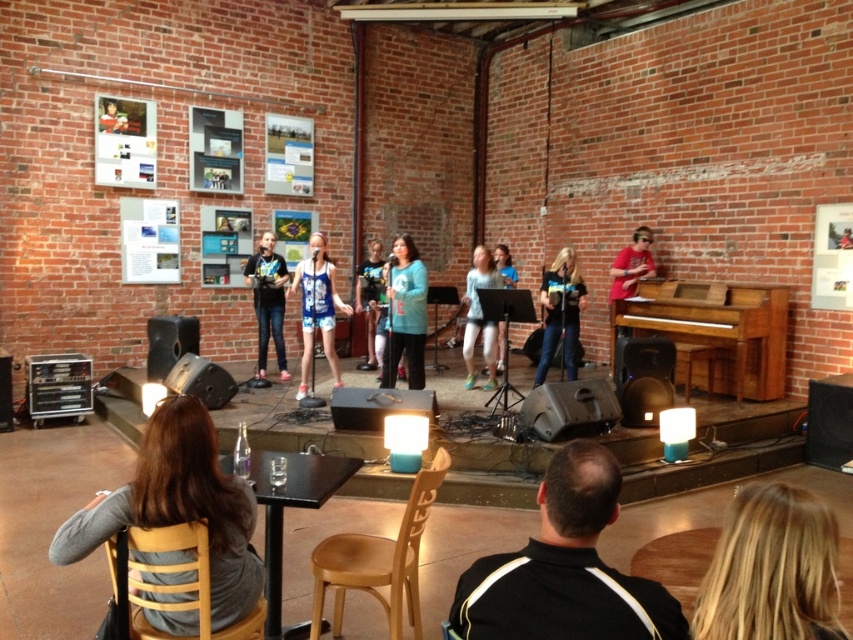
Can you confirm if matte blue jeans at center is positioned above blue denim shorts at center?

Incorrect, matte blue jeans at center is not positioned above blue denim shorts at center.

From the picture: Can you confirm if matte blue jeans at center is positioned below blue denim shorts at center?

Correct, matte blue jeans at center is located below blue denim shorts at center.

The width and height of the screenshot is (853, 640). Describe the element at coordinates (560, 312) in the screenshot. I see `matte blue jeans at center` at that location.

I want to click on matte blue jeans at center, so click(560, 312).

Which is below, matte black speaker at lower left or matte red shirt at right?

matte black speaker at lower left

Is matte black speaker at lower left thinner than matte red shirt at right?

In fact, matte black speaker at lower left might be wider than matte red shirt at right.

You are a GUI agent. You are given a task and a screenshot of the screen. Output one action in this format:
    pyautogui.click(x=<x>, y=<y>)
    Task: Click on the matte black speaker at lower left
    
    Given the screenshot: What is the action you would take?
    pyautogui.click(x=201, y=380)

Find the location of a particular element. The height and width of the screenshot is (640, 853). gray fabric shirt at lower left is located at coordinates (178, 506).

Is gray fabric shirt at lower left taller than blonde hair at lower right?

Yes.

Is point (224, 627) positioned before point (805, 509)?

No, (224, 627) is behind (805, 509).

Where is `gray fabric shirt at lower left`? Image resolution: width=853 pixels, height=640 pixels. gray fabric shirt at lower left is located at coordinates (178, 506).